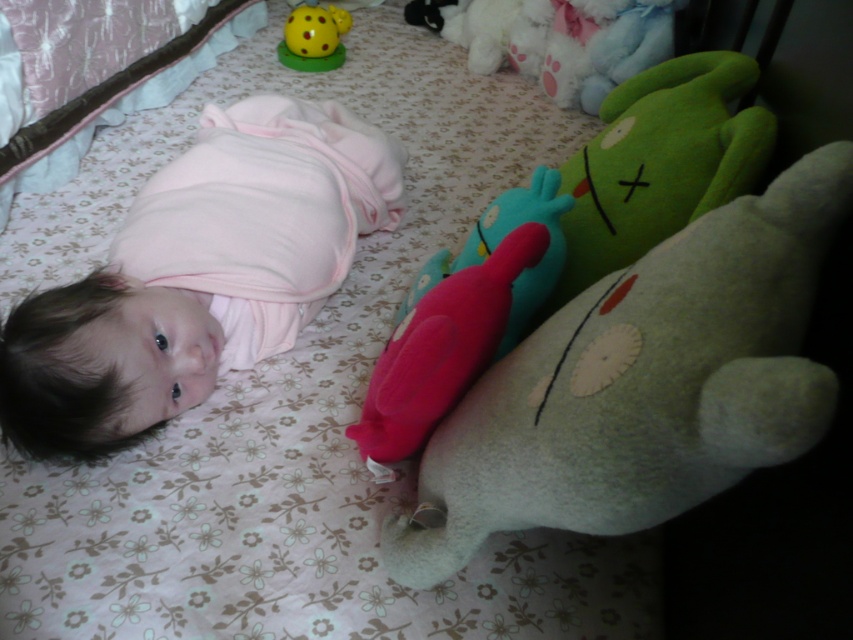
Question: Considering the relative positions of fluffy green bear at center and yellow rubber ball at upper center in the image provided, where is fluffy green bear at center located with respect to yellow rubber ball at upper center?

Choices:
 (A) left
 (B) right

Answer: (B)

Question: Which object is farther from the camera taking this photo?

Choices:
 (A) fluffy green bear at center
 (B) pink soft fabric baby at upper left

Answer: (B)

Question: Is fluffy green bear at center further to camera compared to rubber duck at center?

Choices:
 (A) no
 (B) yes

Answer: (A)

Question: Which of the following is the closest to the observer?

Choices:
 (A) yellow rubber ball at upper center
 (B) fluffy green bear at center
 (C) pink soft fabric baby at upper left
 (D) rubber duck at center

Answer: (B)

Question: Estimate the real-world distances between objects in this image. Which object is farther from the rubber duck at center?

Choices:
 (A) pink soft fabric baby at upper left
 (B) yellow rubber ball at upper center
 (C) fluffy green bear at center

Answer: (B)

Question: Is fluffy green bear at center closer to camera compared to pink soft fabric baby at upper left?

Choices:
 (A) yes
 (B) no

Answer: (A)